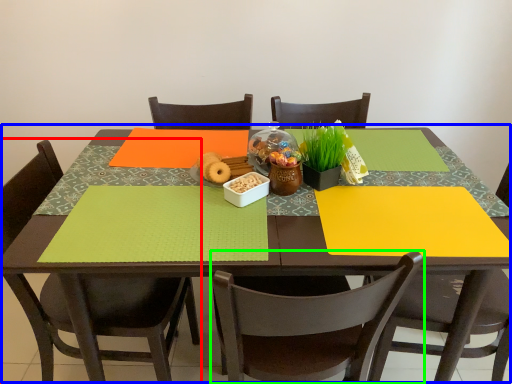
Question: Which is farther away from chair (highlighted by a red box)? table (highlighted by a blue box) or chair (highlighted by a green box)?

Choices:
 (A) table
 (B) chair

Answer: (B)